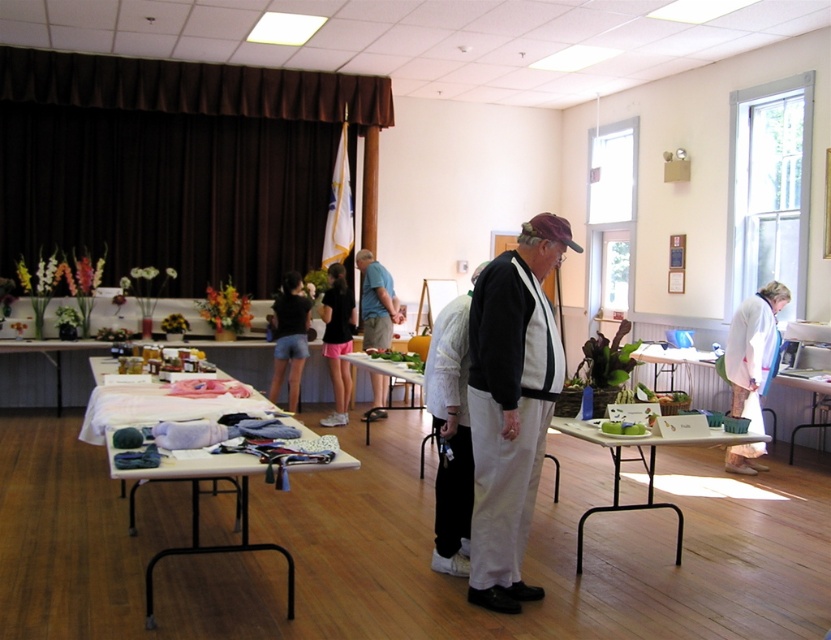
Question: Does white cotton pants at center appear over white fabric table at center?

Choices:
 (A) yes
 (B) no

Answer: (A)

Question: Does denim shorts at center have a lesser width compared to white fabric table at center?

Choices:
 (A) no
 (B) yes

Answer: (B)

Question: Can you confirm if black cotton shorts at center is thinner than denim shorts at center?

Choices:
 (A) no
 (B) yes

Answer: (B)

Question: Estimate the real-world distances between objects in this image. Which object is closer to the white fabric table at center?

Choices:
 (A) denim shorts at center
 (B) white fabric at right
 (C) white fabric at center

Answer: (A)

Question: Which object is closer to the camera taking this photo?

Choices:
 (A) black cotton shorts at center
 (B) white fabric at center
 (C) white fabric table at center

Answer: (B)

Question: Which point appears closest to the camera in this image?

Choices:
 (A) (298, 376)
 (B) (374, 308)

Answer: (B)